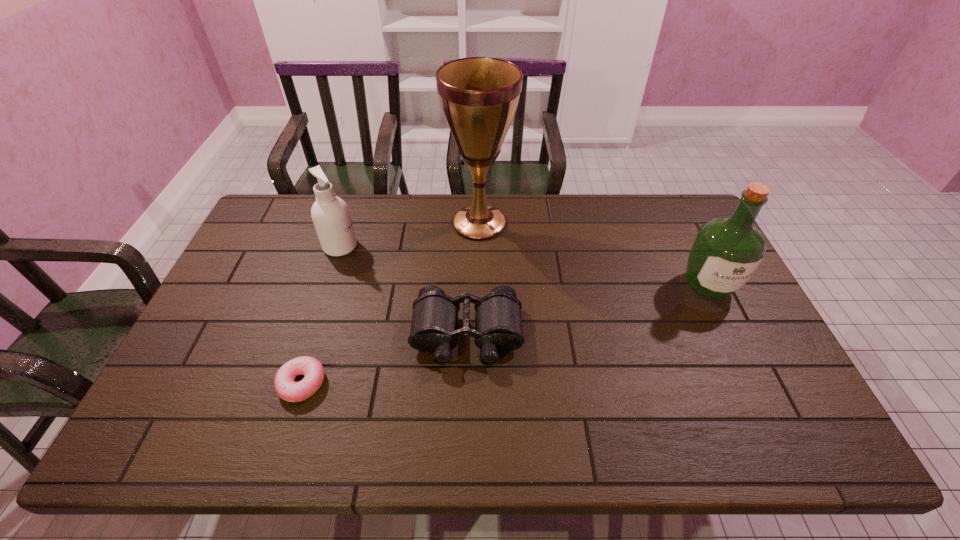
At what (x,y) coordinates should I click in order to perform the action: click on vacant region between the second tallest object and the trophy cup. Please return your answer as a coordinate pair (x, y). Image resolution: width=960 pixels, height=540 pixels. Looking at the image, I should click on (594, 254).

What are the coordinates of `free point between the third tallest object and the doughnut` in the screenshot? It's located at (x=321, y=315).

The height and width of the screenshot is (540, 960). Find the location of `empty space that is in between the cleansing agent and the second shortest object`. empty space that is in between the cleansing agent and the second shortest object is located at coordinates (403, 291).

Locate an element on the screen. The width and height of the screenshot is (960, 540). vacant region between the binoculars and the trophy cup is located at coordinates (473, 279).

Where is `vacant area between the binoculars and the trophy cup`? vacant area between the binoculars and the trophy cup is located at coordinates (473, 279).

Where is `unoccupied area between the trophy cup and the binoculars`? unoccupied area between the trophy cup and the binoculars is located at coordinates (473, 279).

Find the location of `vacant region between the binoculars and the rightmost object`. vacant region between the binoculars and the rightmost object is located at coordinates (588, 310).

Locate an element on the screen. The height and width of the screenshot is (540, 960). free spot between the trophy cup and the third tallest object is located at coordinates coord(410,234).

Locate an element on the screen. This screenshot has width=960, height=540. vacant region between the trophy cup and the binoculars is located at coordinates (473, 279).

Locate which object ranks second in proximity to the cleansing agent. Please provide its 2D coordinates. Your answer should be formatted as a tuple, i.e. [(x, y)], where the tuple contains the x and y coordinates of a point satisfying the conditions above.

[(498, 326)]